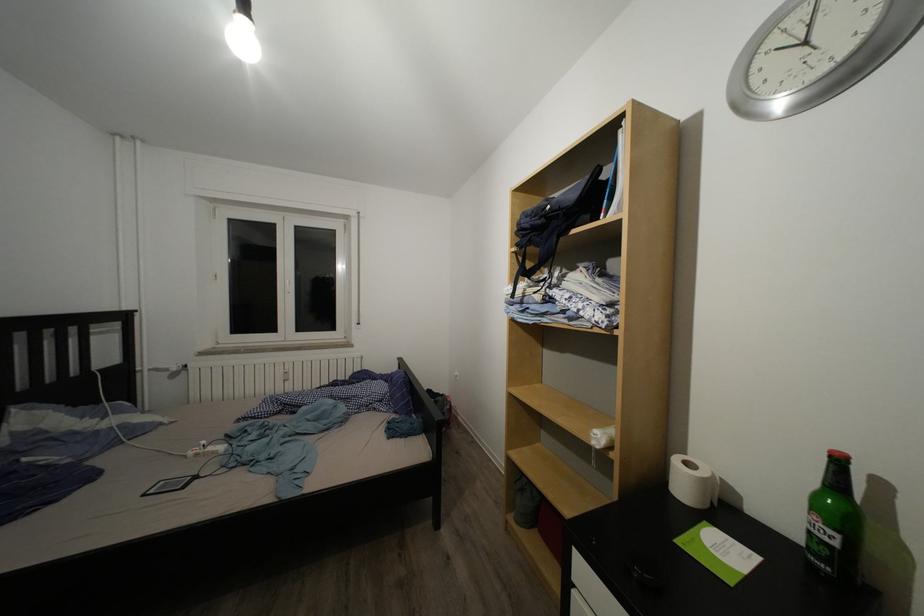
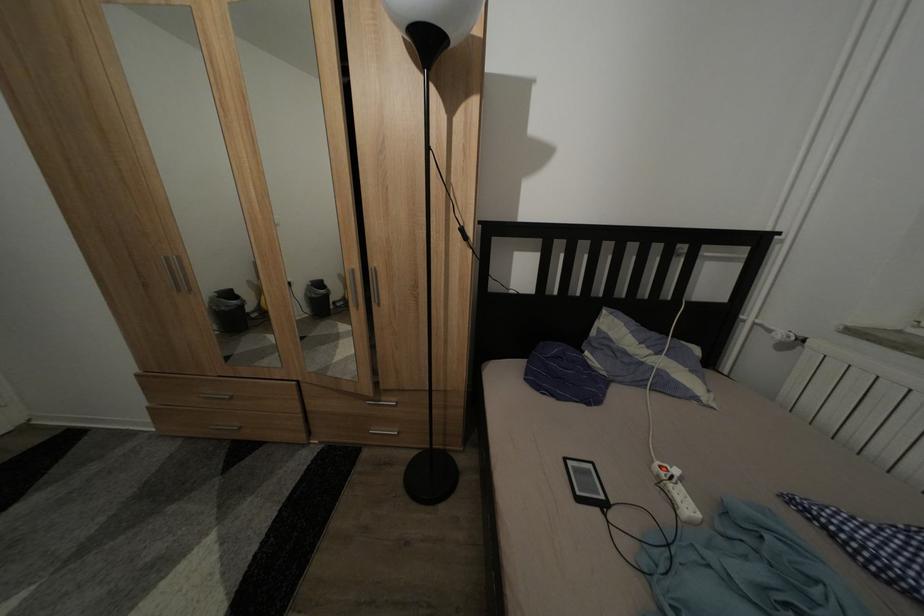
Locate, in the second image, the point that corresponds to (x=151, y=501) in the first image.

(573, 466)